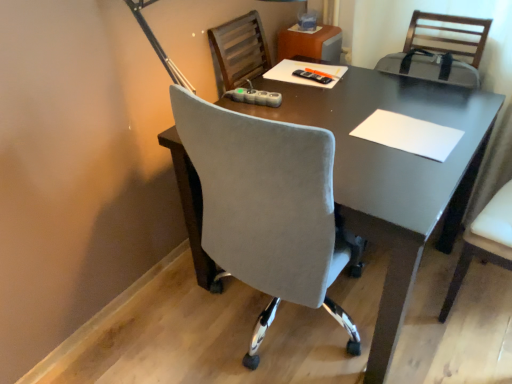
Locate an element on the screen. black plastic remote control at center is located at coordinates (313, 76).

At what (x,y) coordinates should I click in order to perform the action: click on white leather chair at right. Please return your answer as a coordinate pair (x, y). This screenshot has height=384, width=512. Looking at the image, I should click on pos(485,242).

From the picture: How much distance is there between black plastic remote control at center and white leather chair at right?

The distance of black plastic remote control at center from white leather chair at right is 33.09 inches.

From a real-world perspective, which is physically above, black plastic remote control at center or white leather chair at right?

black plastic remote control at center.

Is black plastic remote control at center next to white leather chair at right and touching it?

black plastic remote control at center and white leather chair at right are not in contact.

From the image's perspective, is black plastic remote control at center on top of white leather chair at right?

Yes, from the image's perspective, black plastic remote control at center is on top of white leather chair at right.

Does black plastic remote control at center turn towards white paper at center?

Yes, black plastic remote control at center is facing white paper at center.

Consider the image. From a real-world perspective, which is physically above, black plastic remote control at center or white paper at center?

black plastic remote control at center, from a real-world perspective.

Is black plastic remote control at center inside the boundaries of white paper at center, or outside?

black plastic remote control at center is spatially situated outside white paper at center.

Does point (300, 76) come farther from viewer compared to point (448, 130)?

That is True.

Does white leather chair at right have a smaller size compared to white paper at center?

Actually, white leather chair at right might be larger than white paper at center.

From a real-world perspective, between white leather chair at right and white paper at center, who is vertically lower?

white leather chair at right, from a real-world perspective.

From the picture: Is white leather chair at right beside white paper at center?

No, white leather chair at right is not making contact with white paper at center.

Relative to white paper at center, is white leather chair at right in front or behind?

white leather chair at right is in front of white paper at center.

Find the location of a particular element. The image size is (512, 384). chair that appears on the right of white paper at center is located at coordinates (485, 242).

From the image's perspective, between white paper at center and white leather chair at right, which one is located above?

white paper at center.

Looking at the image, does white paper at center seem bigger or smaller compared to white leather chair at right?

In the image, white paper at center appears to be smaller than white leather chair at right.

From a real-world perspective, between white paper at center and white leather chair at right, who is vertically higher?

white paper at center.

What's the angular difference between white paper at center and black plastic remote control at center's facing directions?

white paper at center and black plastic remote control at center are facing 7.36 degrees away from each other.

Does white paper at center come behind black plastic remote control at center?

No, it is in front of black plastic remote control at center.

Is white paper at center smaller than black plastic remote control at center?

No.

Is white paper at center oriented towards black plastic remote control at center?

No, white paper at center does not turn towards black plastic remote control at center.

How different are the orientations of white leather chair at right and black plastic remote control at center in degrees?

There is a 84.8-degree angle between the facing directions of white leather chair at right and black plastic remote control at center.

From the image's perspective, is white leather chair at right located above or below black plastic remote control at center?

Clearly, from the image's perspective, white leather chair at right is below black plastic remote control at center.

Is white leather chair at right facing away from black plastic remote control at center?

No, white leather chair at right's orientation is not away from black plastic remote control at center.

From a real-world perspective, is white leather chair at right above or below black plastic remote control at center?

In terms of real-world spatial position, white leather chair at right is below black plastic remote control at center.

This screenshot has height=384, width=512. What are the coordinates of `stationery behind the white leather chair at right` in the screenshot? It's located at (313, 76).

Image resolution: width=512 pixels, height=384 pixels. I want to click on stationery that appears on the left of white paper at center, so click(x=313, y=76).

When comparing their distances from white paper at center, does white leather chair at right or black plastic remote control at center seem closer?

white leather chair at right is positioned closer to the anchor white paper at center.

From the image, which object appears to be farther from black plastic remote control at center, white leather chair at right or white paper at center?

white leather chair at right.

Considering their positions, is black plastic remote control at center positioned further to white paper at center than white leather chair at right?

Among the two, black plastic remote control at center is located further to white paper at center.

Based on their spatial positions, is black plastic remote control at center or white paper at center closer to white leather chair at right?

white paper at center is closer to white leather chair at right.

Considering their positions, is white paper at center positioned closer to black plastic remote control at center than white leather chair at right?

The object closer to black plastic remote control at center is white paper at center.

Looking at the image, which one is located further to white leather chair at right, white paper at center or black plastic remote control at center?

Among the two, black plastic remote control at center is located further to white leather chair at right.

Locate an element on the screen. Image resolution: width=512 pixels, height=384 pixels. notepad between white leather chair at right and black plastic remote control at center along the z-axis is located at coordinates (409, 134).